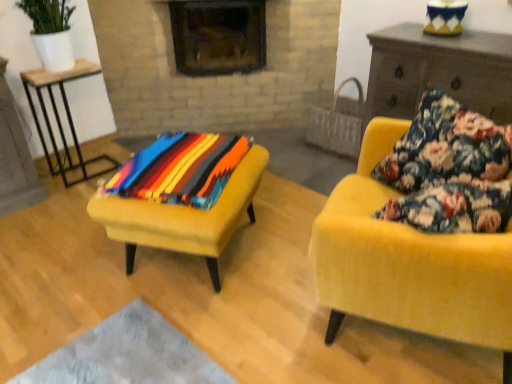
Where is `free location above wooden table at left (from a real-world perspective)`? The image size is (512, 384). free location above wooden table at left (from a real-world perspective) is located at coordinates (57, 71).